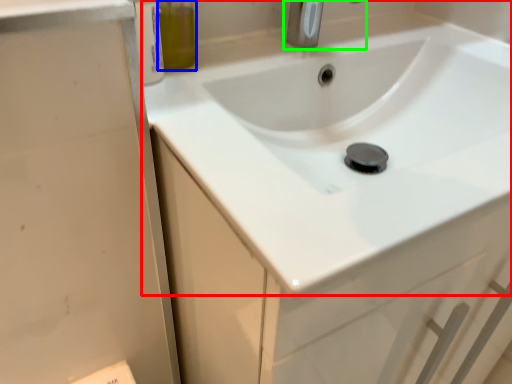
Question: Based on their relative distances, which object is nearer to sink (highlighted by a red box)? Choose from olive oil (highlighted by a blue box) and tap (highlighted by a green box).

Choices:
 (A) olive oil
 (B) tap

Answer: (B)